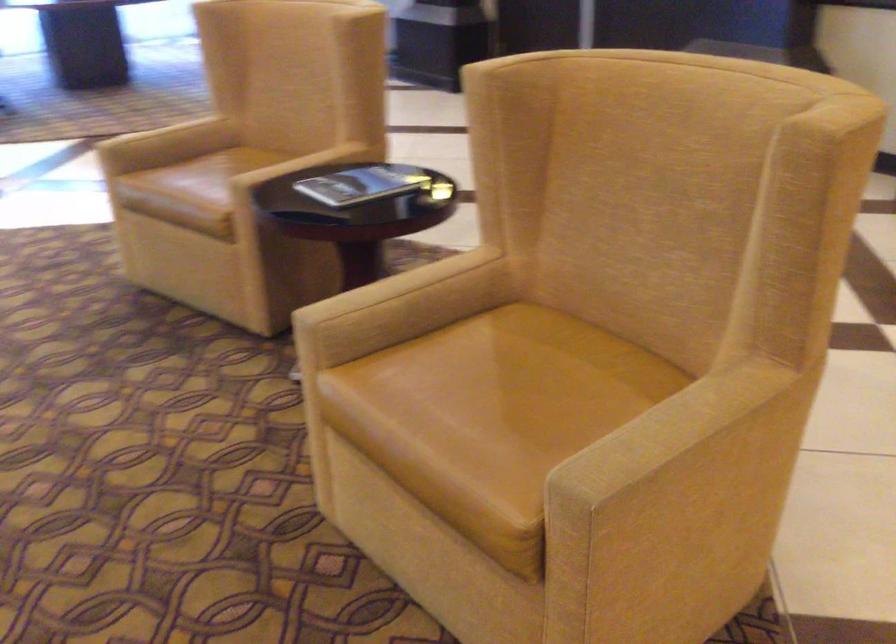
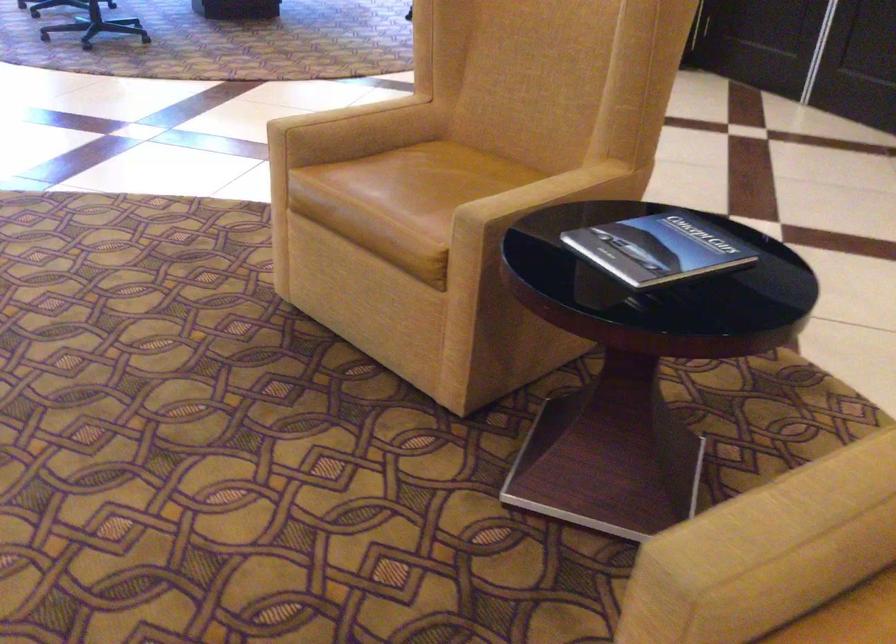
The point at [297,163] is marked in the first image. Where is the corresponding point in the second image?

(541, 193)